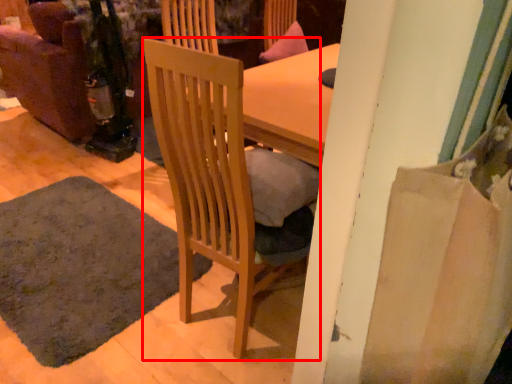
Question: From the image's perspective, considering the relative positions of chair (annotated by the red box) and mat in the image provided, where is chair (annotated by the red box) located with respect to the staircase?

Choices:
 (A) above
 (B) below

Answer: (A)